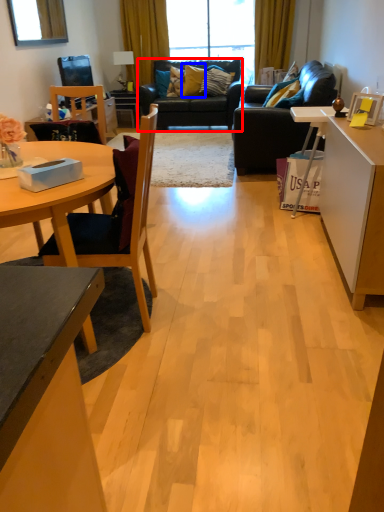
Question: Which object is closer to the camera taking this photo, studio couch (highlighted by a red box) or pillow (highlighted by a blue box)?

Choices:
 (A) studio couch
 (B) pillow

Answer: (A)